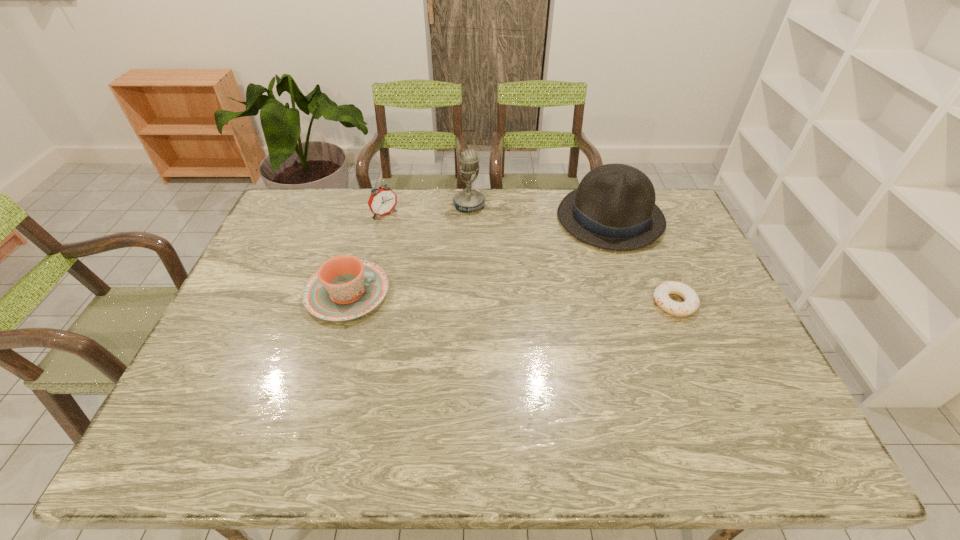
Where is `free point between the fourth shortest object and the shortest object`? free point between the fourth shortest object and the shortest object is located at coordinates (642, 261).

At what (x,y) coordinates should I click in order to perform the action: click on vacant area that lies between the second tallest object and the alarm clock. Please return your answer as a coordinate pair (x, y). This screenshot has width=960, height=540. Looking at the image, I should click on (497, 216).

Where is `free point between the bowler hat and the shortest object`? The width and height of the screenshot is (960, 540). free point between the bowler hat and the shortest object is located at coordinates (642, 261).

At what (x,y) coordinates should I click in order to perform the action: click on empty space between the shortest object and the chinaware. Please return your answer as a coordinate pair (x, y). This screenshot has height=540, width=960. Looking at the image, I should click on (511, 298).

Where is `vacant space in between the alarm clock and the third object from right to left`? vacant space in between the alarm clock and the third object from right to left is located at coordinates (427, 210).

Locate an element on the screen. Image resolution: width=960 pixels, height=540 pixels. free space between the bowler hat and the doughnut is located at coordinates (642, 261).

What are the coordinates of `vacant point located between the third tallest object and the doughnut` in the screenshot? It's located at (530, 259).

At what (x,y) coordinates should I click in order to perform the action: click on free point between the microphone and the alarm clock. Please return your answer as a coordinate pair (x, y). This screenshot has height=540, width=960. Looking at the image, I should click on (427, 210).

I want to click on vacant region between the third object from right to left and the third shortest object, so click(x=427, y=210).

Point out which object is positioned as the fourth nearest to the chinaware. Please provide its 2D coordinates. Your answer should be formatted as a tuple, i.e. [(x, y)], where the tuple contains the x and y coordinates of a point satisfying the conditions above.

[(691, 302)]